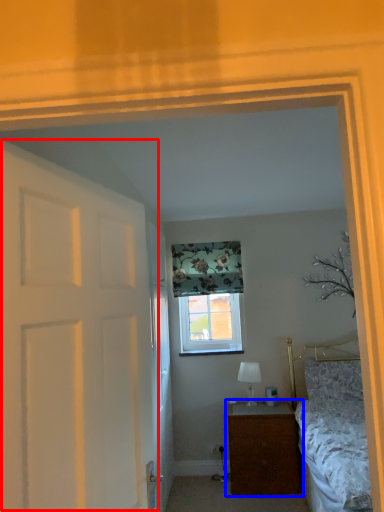
Question: Which of the following is the farthest to the observer, door (highlighted by a red box) or nightstand (highlighted by a blue box)?

Choices:
 (A) door
 (B) nightstand

Answer: (B)